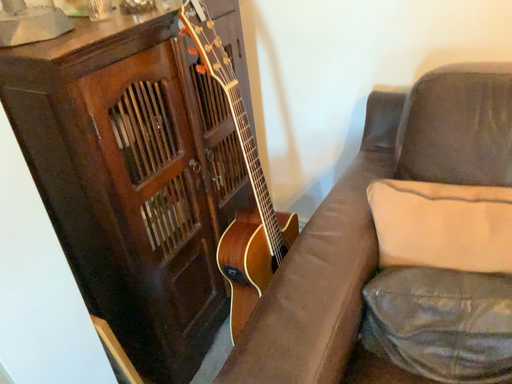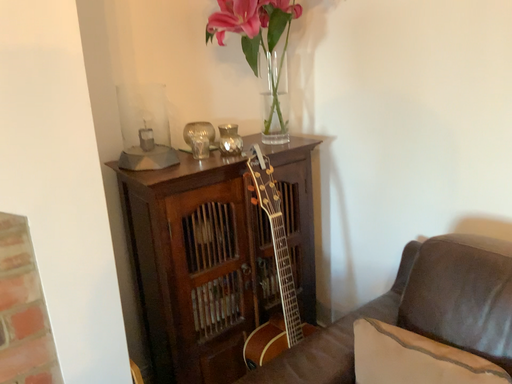
Question: How did the camera likely rotate when shooting the video?

Choices:
 (A) rotated left
 (B) rotated right

Answer: (A)